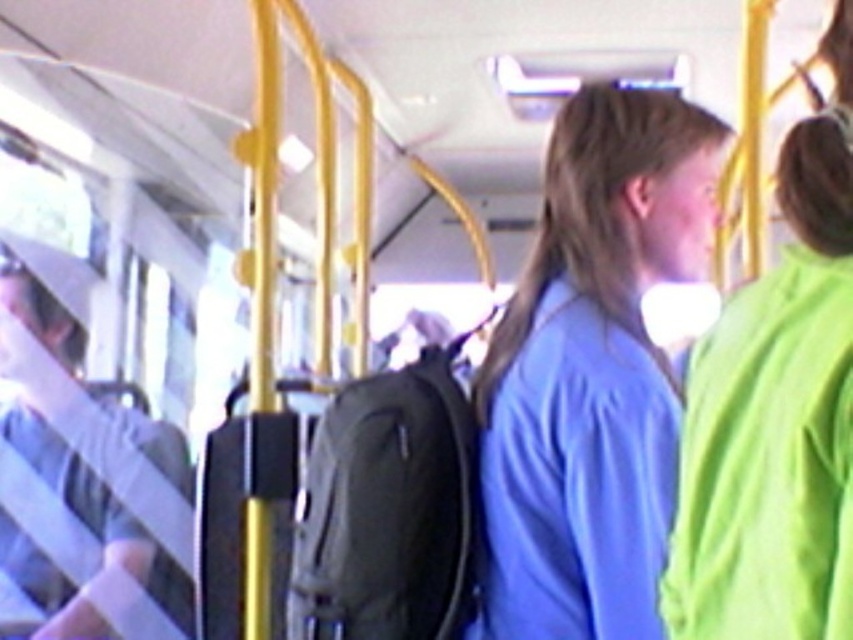
Question: Which point appears closest to the camera in this image?

Choices:
 (A) (27, 282)
 (B) (672, 202)
 (C) (689, 388)

Answer: (C)

Question: Is blue fabric shirt at center above light gray fabric bag at left?

Choices:
 (A) yes
 (B) no

Answer: (A)

Question: Which object appears farthest from the camera in this image?

Choices:
 (A) blue fabric shirt at center
 (B) light gray fabric bag at left

Answer: (B)

Question: Does blue matte shirt at center come in front of blue fabric shirt at center?

Choices:
 (A) no
 (B) yes

Answer: (A)

Question: Which object appears closest to the camera in this image?

Choices:
 (A) light gray fabric bag at left
 (B) blue matte shirt at center
 (C) blue fabric shirt at center

Answer: (C)

Question: Is blue matte shirt at center to the left of light gray fabric bag at left from the viewer's perspective?

Choices:
 (A) no
 (B) yes

Answer: (A)